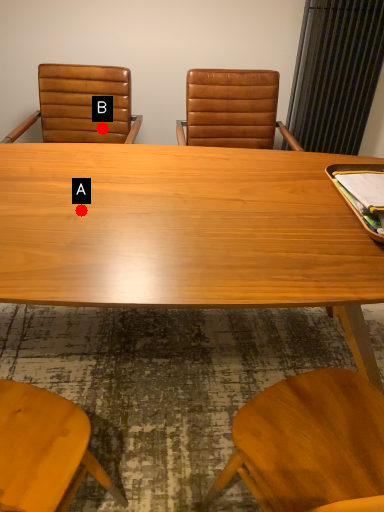
Question: Two points are circled on the image, labeled by A and B beside each circle. Which point is farther to the camera?

Choices:
 (A) A is further
 (B) B is further

Answer: (B)